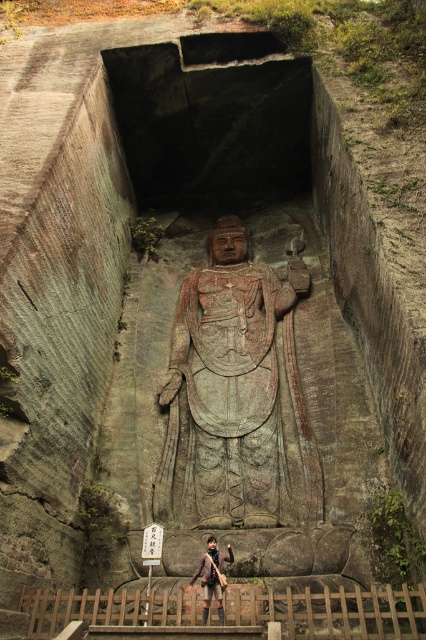
Question: Is gray stone statue at center positioned behind brown leather jacket at lower center?

Choices:
 (A) no
 (B) yes

Answer: (B)

Question: Among these points, which one is farthest from the camera?

Choices:
 (A) (298, 435)
 (B) (207, 557)

Answer: (A)

Question: Among these points, which one is nearest to the camera?

Choices:
 (A) (213, 468)
 (B) (195, 572)

Answer: (B)

Question: Can you confirm if gray stone statue at center is wider than brown leather jacket at lower center?

Choices:
 (A) yes
 (B) no

Answer: (A)

Question: Does gray stone statue at center appear over brown leather jacket at lower center?

Choices:
 (A) no
 (B) yes

Answer: (B)